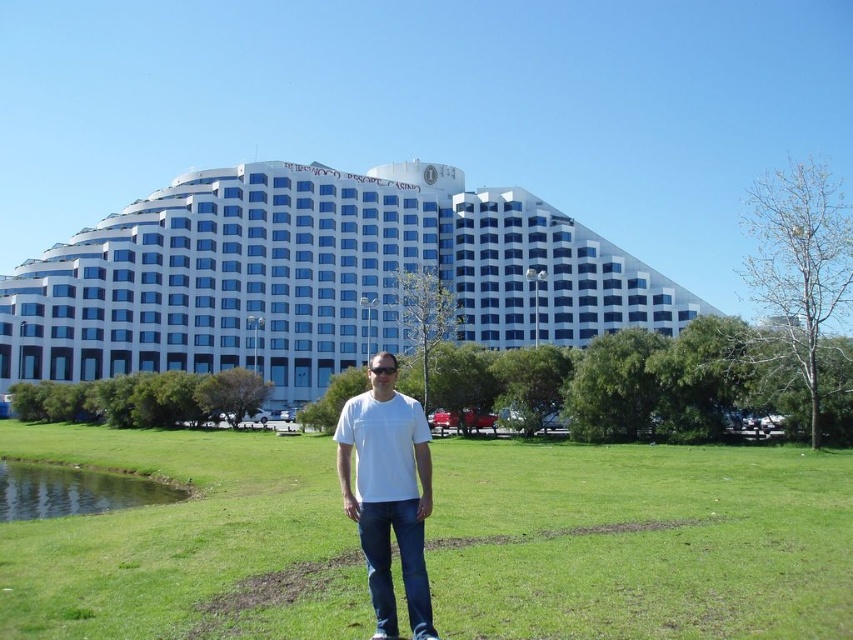
Question: Which point is closer to the camera?

Choices:
 (A) (90, 433)
 (B) (80, 502)

Answer: (B)

Question: Is white glass building at center to the right of green grassy lake at lower left from the viewer's perspective?

Choices:
 (A) no
 (B) yes

Answer: (B)

Question: Estimate the real-world distances between objects in this image. Which object is farther from the white matte t-shirt at center?

Choices:
 (A) white glass building at center
 (B) green grassy lake at lower left

Answer: (A)

Question: Is white matte t-shirt at center to the right of green grassy lake at lower left from the viewer's perspective?

Choices:
 (A) yes
 (B) no

Answer: (A)

Question: Can you confirm if white matte t-shirt at center is positioned above green grassy lake at lower left?

Choices:
 (A) yes
 (B) no

Answer: (A)

Question: Which is nearer to the green grassy lake at lower left?

Choices:
 (A) green grass at center
 (B) white glass building at center

Answer: (A)